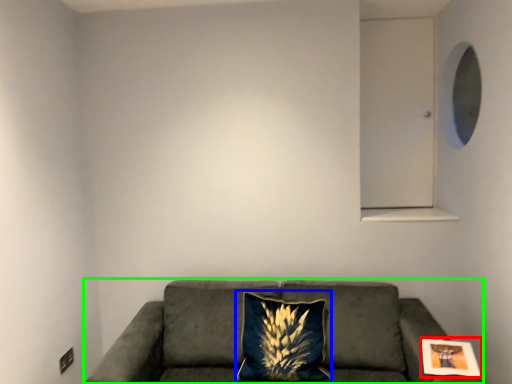
Question: Considering the real-world distances, which object is farthest from picture frame (highlighted by a red box)? pillow (highlighted by a blue box) or studio couch (highlighted by a green box)?

Choices:
 (A) pillow
 (B) studio couch

Answer: (A)